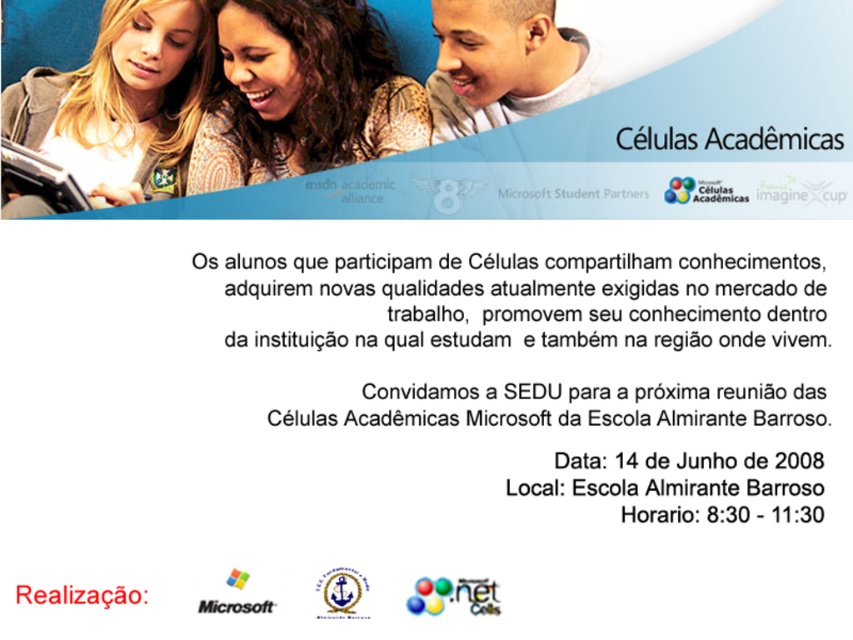
You are a graphic designer working on the promotional flyer for C?lulas Acad?micas. You need to place a new element at point (122,100). However, there is already an object there. What is the object at that coordinate?

The object at point (122,100) is the matte black laptop at left.

You are a photographer who wants to take a closeup shot of the brown textured sweater at upper center without the matte black laptop at left appearing in the frame. Is this possible based on their positions?

The brown textured sweater at upper center is further to the viewer than the matte black laptop at left. Therefore, you can position the camera closer to the sweater, ensuring the laptop at left is out of frame.

You are designing a layout for a promotional flyer and need to adjust the placement of the matte black laptop at left and the black matte microsoft logo at upper center. Based on their current positions, which object is closer to the viewer?

The matte black laptop at left is closer to the viewer than the black matte microsoft logo at upper center.